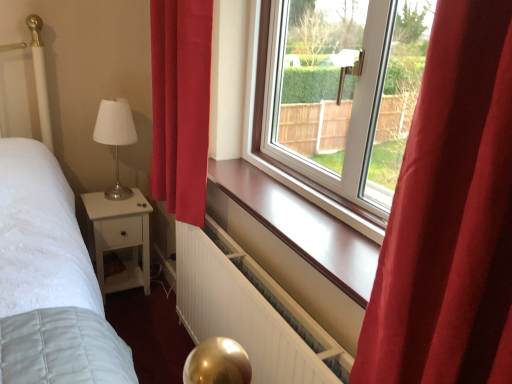
Question: Can you confirm if white matte radiator at lower center is smaller than white satin table lamp at left?

Choices:
 (A) no
 (B) yes

Answer: (A)

Question: Considering the relative sizes of white matte radiator at lower center and white satin table lamp at left in the image provided, is white matte radiator at lower center taller than white satin table lamp at left?

Choices:
 (A) yes
 (B) no

Answer: (A)

Question: Can we say white matte radiator at lower center lies outside white satin table lamp at left?

Choices:
 (A) no
 (B) yes

Answer: (B)

Question: Is white matte radiator at lower center to the right of white satin table lamp at left from the viewer's perspective?

Choices:
 (A) no
 (B) yes

Answer: (B)

Question: Is white matte radiator at lower center positioned behind white satin table lamp at left?

Choices:
 (A) no
 (B) yes

Answer: (A)

Question: From a real-world perspective, is white matte radiator at lower center beneath white satin table lamp at left?

Choices:
 (A) yes
 (B) no

Answer: (A)

Question: Can you confirm if white matte radiator at lower center is shorter than red velvet curtain at left?

Choices:
 (A) no
 (B) yes

Answer: (B)

Question: Can you confirm if white matte radiator at lower center is wider than red velvet curtain at left?

Choices:
 (A) no
 (B) yes

Answer: (A)

Question: Is white matte radiator at lower center closer to the viewer compared to red velvet curtain at left?

Choices:
 (A) yes
 (B) no

Answer: (A)

Question: Is red velvet curtain at left completely or partially inside white matte radiator at lower center?

Choices:
 (A) no
 (B) yes

Answer: (A)

Question: Is white matte radiator at lower center further to camera compared to red velvet curtain at left?

Choices:
 (A) yes
 (B) no

Answer: (B)

Question: Can you confirm if white matte radiator at lower center is positioned to the right of red velvet curtain at left?

Choices:
 (A) no
 (B) yes

Answer: (B)

Question: From a real-world perspective, is white satin table lamp at left on top of red velvet curtain at left?

Choices:
 (A) no
 (B) yes

Answer: (A)